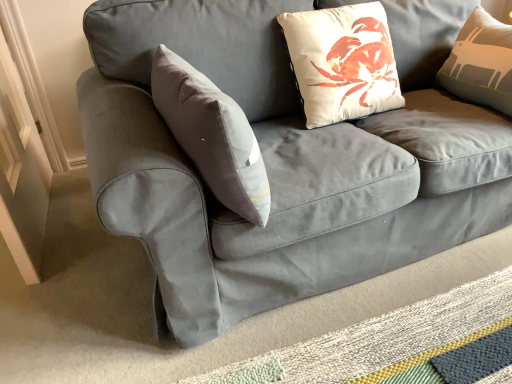
Question: Is the depth of textured woven mat at lower right less than that of white matte pillow at upper center?

Choices:
 (A) no
 (B) yes

Answer: (B)

Question: Is textured woven mat at lower right next to white matte pillow at upper center?

Choices:
 (A) no
 (B) yes

Answer: (A)

Question: Does textured woven mat at lower right have a greater width compared to white matte pillow at upper center?

Choices:
 (A) yes
 (B) no

Answer: (A)

Question: From the image's perspective, is textured woven mat at lower right beneath white matte pillow at upper center?

Choices:
 (A) yes
 (B) no

Answer: (A)

Question: Considering the relative positions of textured woven mat at lower right and white matte pillow at upper center in the image provided, is textured woven mat at lower right to the left of white matte pillow at upper center from the viewer's perspective?

Choices:
 (A) no
 (B) yes

Answer: (A)

Question: Is white matte pillow at upper center located within textured woven mat at lower right?

Choices:
 (A) yes
 (B) no

Answer: (B)

Question: Is the depth of white matte pillow at upper center less than that of textured woven mat at lower right?

Choices:
 (A) no
 (B) yes

Answer: (A)

Question: Does white matte pillow at upper center have a greater height compared to textured woven mat at lower right?

Choices:
 (A) no
 (B) yes

Answer: (B)

Question: Can you confirm if white matte pillow at upper center is bigger than textured woven mat at lower right?

Choices:
 (A) no
 (B) yes

Answer: (B)

Question: Is white matte pillow at upper center next to textured woven mat at lower right and touching it?

Choices:
 (A) no
 (B) yes

Answer: (A)

Question: Can you confirm if white matte pillow at upper center is wider than textured woven mat at lower right?

Choices:
 (A) yes
 (B) no

Answer: (B)

Question: Is white matte pillow at upper center further to camera compared to textured woven mat at lower right?

Choices:
 (A) no
 (B) yes

Answer: (B)

Question: Is white matte pillow at upper center wider or thinner than textured woven mat at lower right?

Choices:
 (A) wide
 (B) thin

Answer: (B)